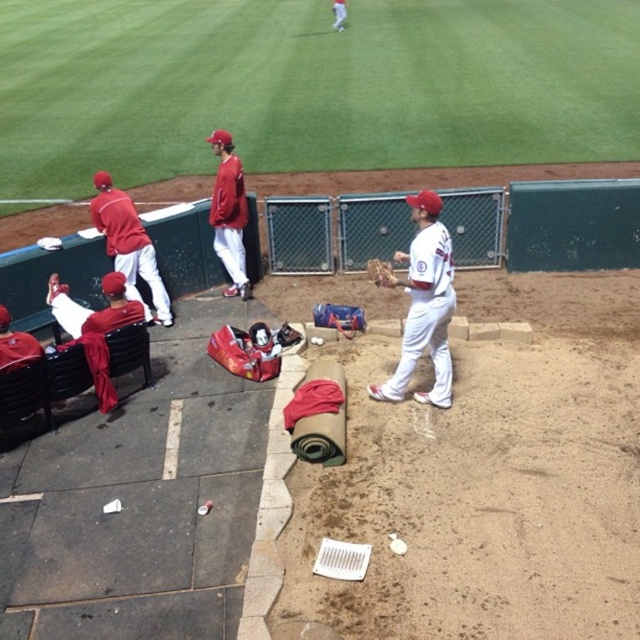
You are a photographer at the baseball game and want to take a photo that includes both the matte red uniform at left and the matte red baseball cap at left. Which object should you focus on first if you want to ensure both are in frame without moving the camera?

The matte red uniform at left is larger in size than the matte red baseball cap at left, so you should focus on the matte red uniform at left first as it takes up more space in the frame, ensuring both objects remain visible.